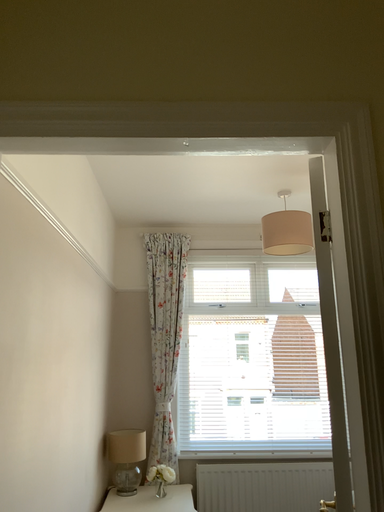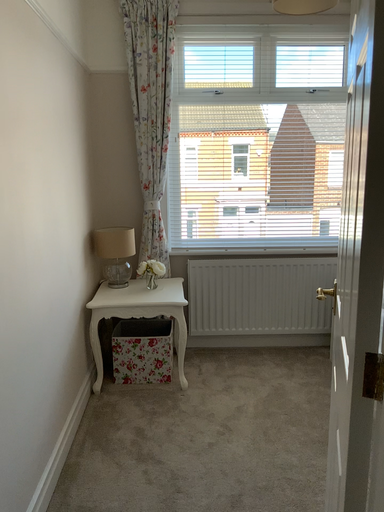
Question: Which way did the camera rotate in the video?

Choices:
 (A) rotated upward
 (B) rotated downward

Answer: (B)